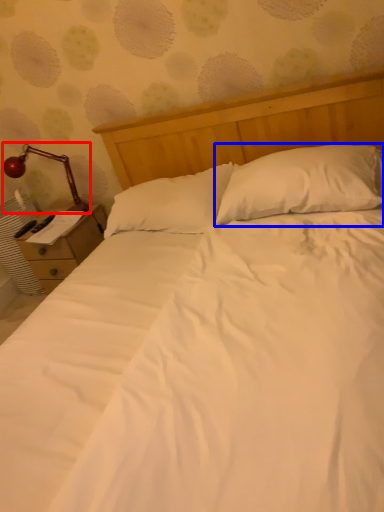
Question: Which object appears farthest to the camera in this image, lamp (highlighted by a red box) or pillow (highlighted by a blue box)?

Choices:
 (A) lamp
 (B) pillow

Answer: (A)